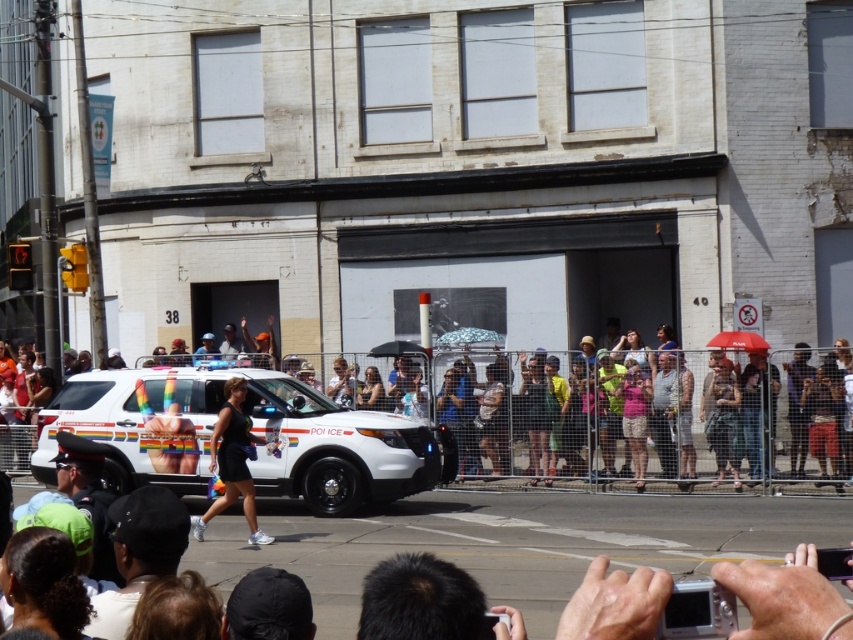
You are a photographer trying to capture both the white glossy police car at center and the black matte dress at center in a single frame. Given their sizes, which object will appear bigger in your photo?

The white glossy police car at center will appear bigger in the photo because it has a larger size compared to the black matte dress at center.

You are a photographer trying to capture the entire crowd at center. You are standing at the point indicated by point (x=590, y=412). Is there enough space around you to move freely?

The point (x=590, y=412) indicates matte white crowd at center, so there is no space around you to move freely as you are in the middle of the crowd.